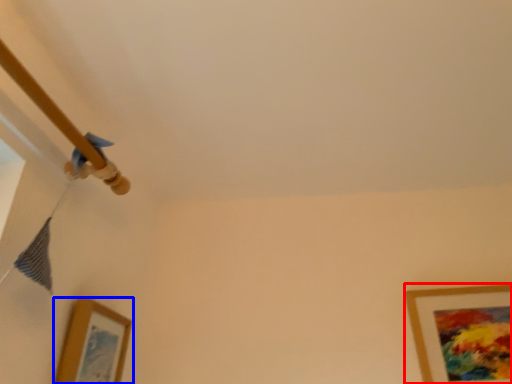
Question: Which object appears closest to the camera in this image, picture frame (highlighted by a red box) or picture frame (highlighted by a blue box)?

Choices:
 (A) picture frame
 (B) picture frame

Answer: (B)